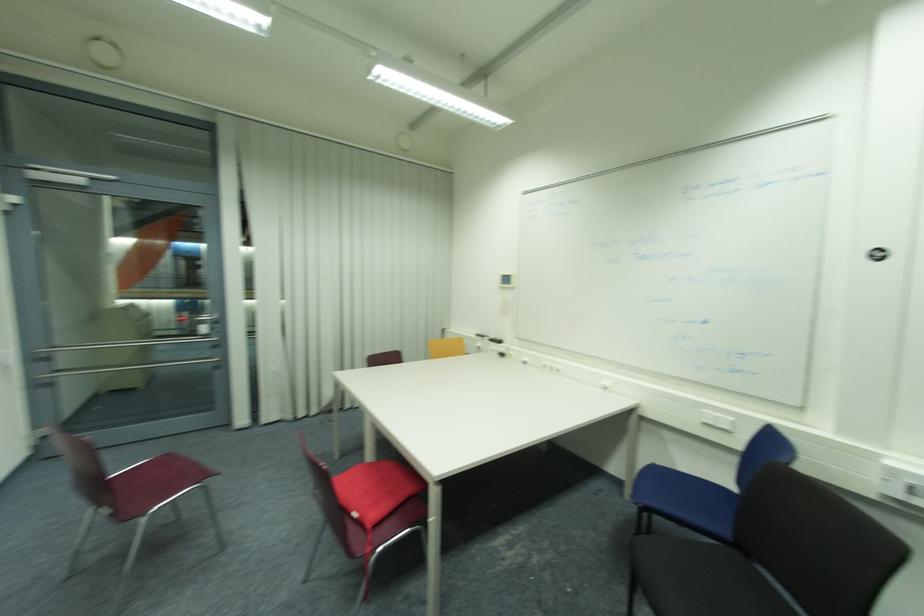
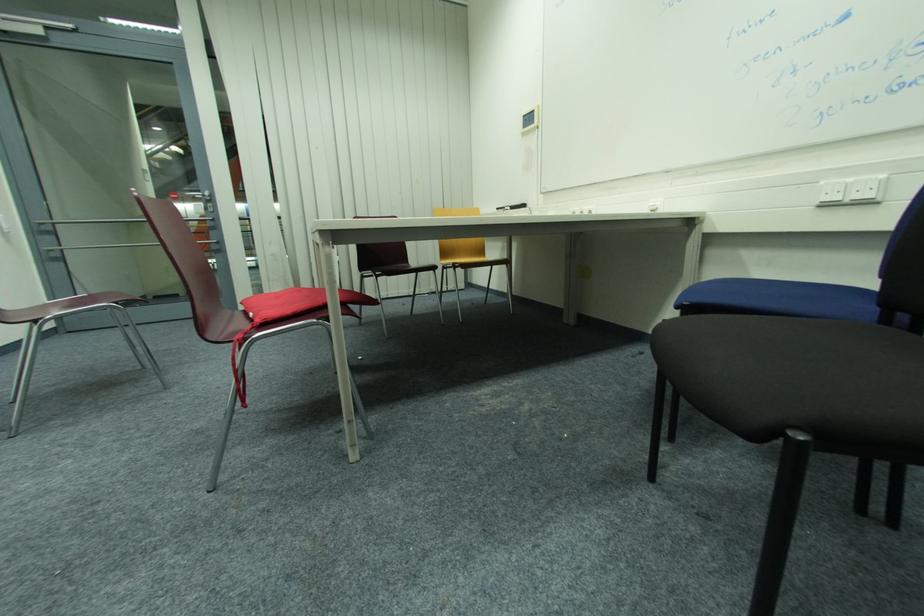
In a continuous first-person perspective shot, in which direction is the camera moving?

The movement direction of the cameraman is right, forward.